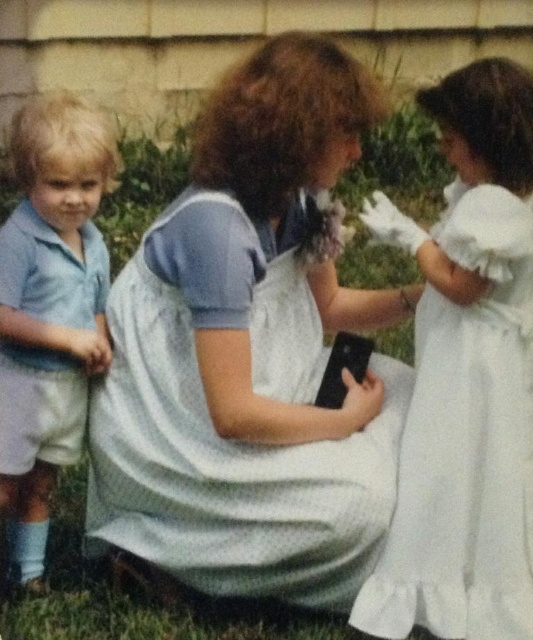
Which is below, white satin dress at right or matte blue shirt at left?

white satin dress at right is below.

Can you confirm if white satin dress at right is bigger than matte blue shirt at left?

Indeed, white satin dress at right has a larger size compared to matte blue shirt at left.

Describe the element at coordinates (463, 435) in the screenshot. I see `white satin dress at right` at that location.

Image resolution: width=533 pixels, height=640 pixels. I want to click on white satin dress at right, so click(463, 435).

Which is behind, point (176, 257) or point (467, 396)?

The point (467, 396) is behind.

Can you confirm if white cotton dress at center is smaller than white satin dress at right?

Incorrect, white cotton dress at center is not smaller in size than white satin dress at right.

In order to click on white cotton dress at center in this screenshot , I will do `click(251, 355)`.

Does white cotton dress at center appear over matte blue shirt at left?

Indeed, white cotton dress at center is positioned over matte blue shirt at left.

Between white cotton dress at center and matte blue shirt at left, which one is positioned lower?

Positioned lower is matte blue shirt at left.

Who is more distant from viewer, (173, 250) or (80, 196)?

Point (80, 196)

Where is `white cotton dress at center`? This screenshot has width=533, height=640. white cotton dress at center is located at coordinates [x=251, y=355].